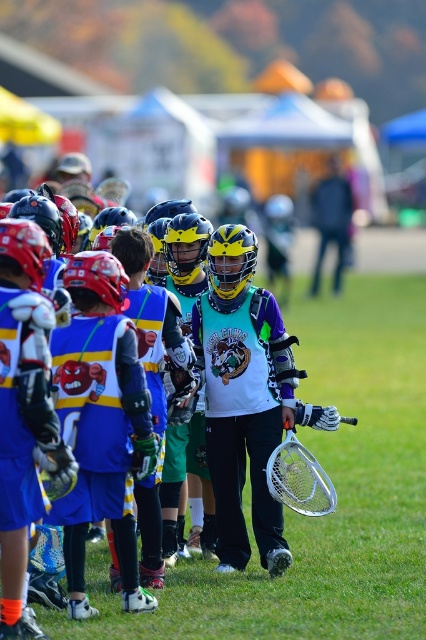
You are a photographer positioned at the edge of the field. You need to capture a photo of both the matte blue jersey at center and the matte yellow helmet at center. Which object should you focus on first if you want to ensure both are in frame without moving the camera?

The matte blue jersey at center is wider than the matte yellow helmet at center, so focus on the matte blue jersey at center first to ensure both fit in the frame.

You are a photographer at the lacrosse field. You want to take a photo of the matte blue jersey at center. Where should you aim your camera to capture it?

The matte blue jersey at center is located at point coordinates of (100,420). Aim your camera at that position to capture it.

You are a photographer at the lacrosse field. You want to take a photo of the matte blue jersey at center and the matte yellow helmet at center. Which object should you zoom in more on to make sure both are clearly visible in the photo?

You should zoom in more on the matte yellow helmet at center because it is larger than the matte blue jersey at center, so zooming in on it will ensure both objects are visible without cropping out either.